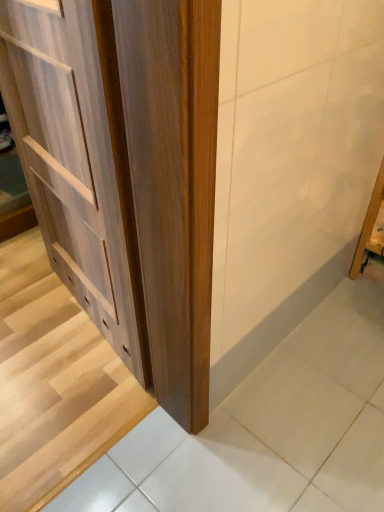
Where is `vacant space underneath light wood cabinet at left (from a real-world perspective)`? vacant space underneath light wood cabinet at left (from a real-world perspective) is located at coordinates (86, 324).